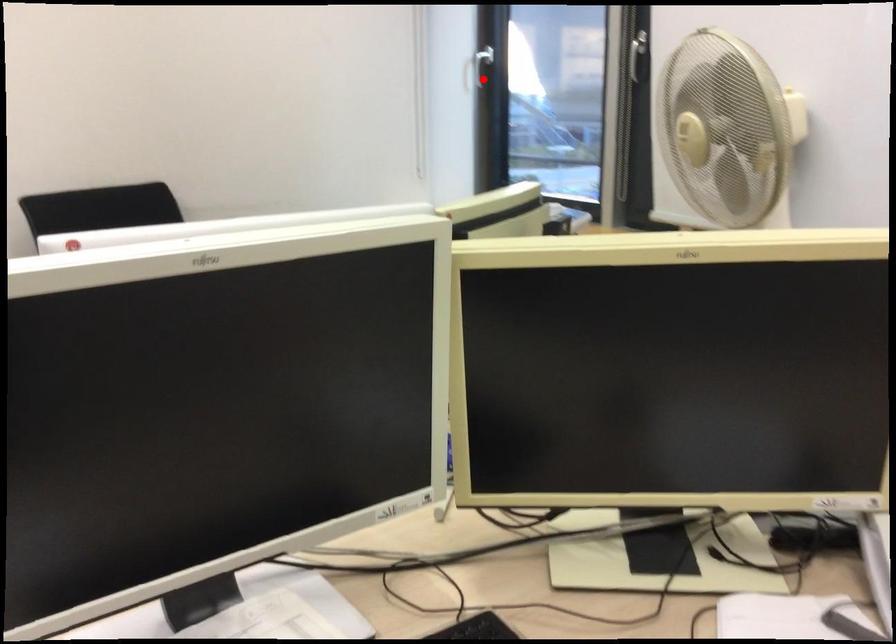
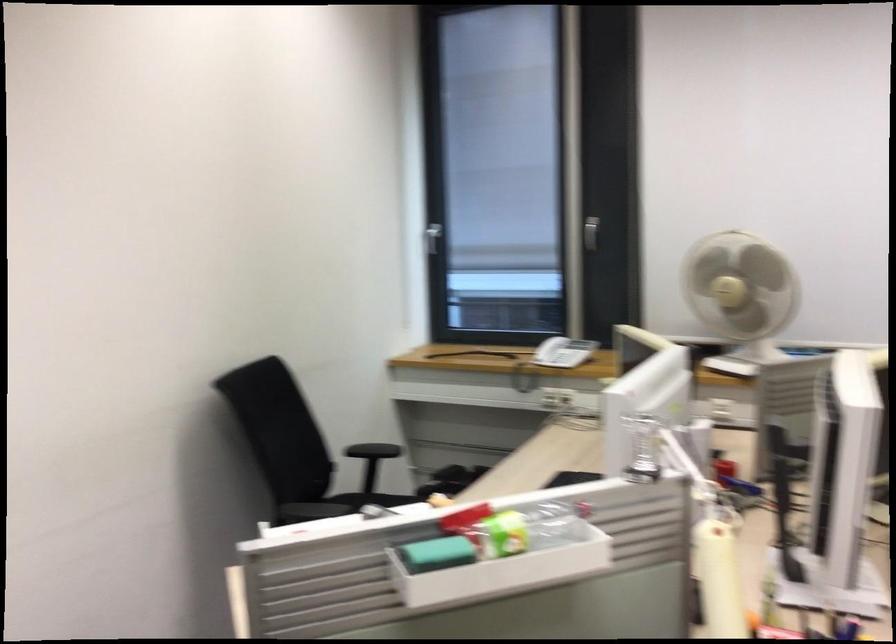
In the second image, find the point that corresponds to the highlighted location in the first image.

(433, 238)